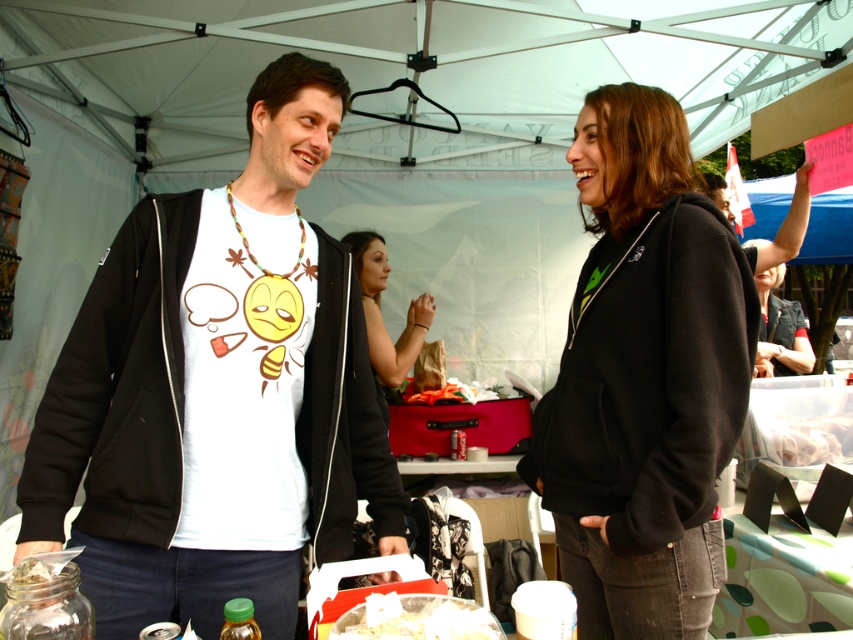
Question: Observing the image, what is the correct spatial positioning of black fleece hoodie at center in reference to white crumbly food at center?

Choices:
 (A) left
 (B) right

Answer: (B)

Question: Estimate the real-world distances between objects in this image. Which object is closer to the black fleece hoodie at center?

Choices:
 (A) white matte t-shirt at center
 (B) white crumbly food at center
 (C) translucent plastic bag at center

Answer: (A)

Question: Among these points, which one is farthest from the camera?

Choices:
 (A) (831, 422)
 (B) (698, 426)
 (C) (218, 545)
 (D) (410, 352)

Answer: (D)

Question: Can you confirm if white matte t-shirt at center is thinner than black fleece hoodie at center?

Choices:
 (A) no
 (B) yes

Answer: (A)

Question: Among these objects, which one is farthest from the camera?

Choices:
 (A) white crumbly food at center
 (B) translucent plastic bag at center

Answer: (B)

Question: Can you confirm if black fleece hoodie at center is positioned above matte black hoodie at center?

Choices:
 (A) yes
 (B) no

Answer: (B)